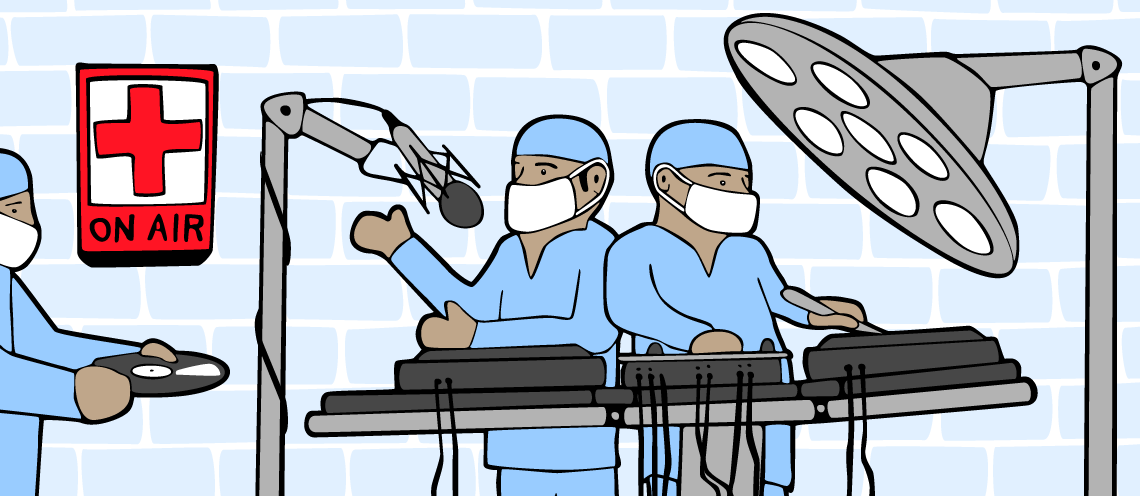
The height and width of the screenshot is (496, 1140). I want to click on light, so click(896, 187).